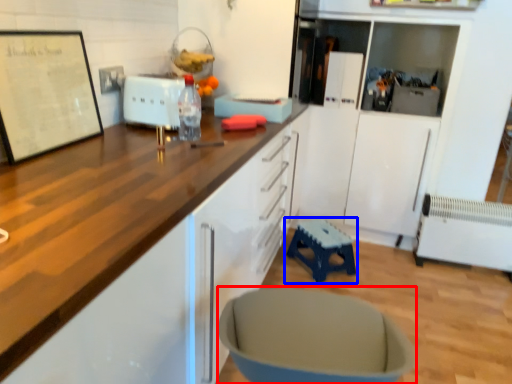
Question: Which object appears closest to the camera in this image, swivel chair (highlighted by a red box) or furniture (highlighted by a blue box)?

Choices:
 (A) swivel chair
 (B) furniture

Answer: (A)